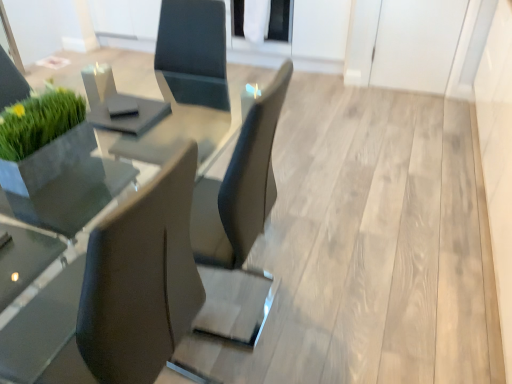
Question: In terms of size, does transparent glass door at upper center appear bigger or smaller than clear glass table at center?

Choices:
 (A) big
 (B) small

Answer: (B)

Question: Relative to clear glass table at center, is transparent glass door at upper center in front or behind?

Choices:
 (A) behind
 (B) front

Answer: (A)

Question: Which object is the closest to the transparent glass door at upper center?

Choices:
 (A) clear glass table at center
 (B) matte black chair at left

Answer: (A)

Question: Which object is positioned farthest from the clear glass table at center?

Choices:
 (A) transparent glass door at upper center
 (B) matte black chair at left

Answer: (A)